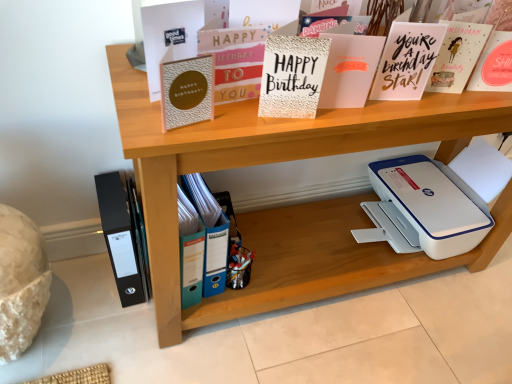
Identify the location of unoccupied area in front of textured gold card at center, which appears as the 4th paperback book when viewed from the right. (263, 128).